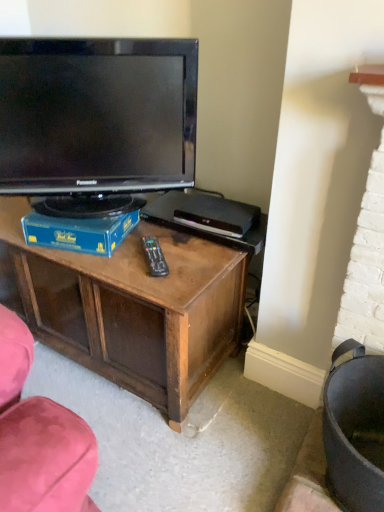
Describe the element at coordinates (97, 115) in the screenshot. I see `black glossy television at upper left` at that location.

This screenshot has height=512, width=384. I want to click on blue cardboard box at center, so pyautogui.click(x=79, y=232).

This screenshot has width=384, height=512. I want to click on black glossy television at upper left, so 97,115.

Considering the points (30, 225) and (145, 163), which point is behind, point (30, 225) or point (145, 163)?

The point (145, 163) is farther from the camera.

From the image's perspective, does blue cardboard box at center appear higher than black glossy television at upper left?

Incorrect, from the image's perspective, blue cardboard box at center is lower than black glossy television at upper left.

Could you tell me if blue cardboard box at center is turned towards black glossy television at upper left?

No, blue cardboard box at center is not oriented towards black glossy television at upper left.

Which is more to the left, blue cardboard box at center or black plastic remote at center?

From the viewer's perspective, blue cardboard box at center appears more on the left side.

Locate an element on the screen. remote in front of the blue cardboard box at center is located at coordinates (155, 257).

Is blue cardboard box at center positioned with its back to black plastic remote at center?

No, blue cardboard box at center is not facing the opposite direction of black plastic remote at center.

Can you confirm if blue cardboard box at center is taller than black plastic remote at center?

Yes, blue cardboard box at center is taller than black plastic remote at center.

Consider the image. Would you say black plastic remote at center is part of black glossy television at upper left's contents?

No, black glossy television at upper left does not contain black plastic remote at center.

You are a GUI agent. You are given a task and a screenshot of the screen. Output one action in this format:
    pyautogui.click(x=<x>, y=<y>)
    Task: Click on the television above the black plastic remote at center (from the image's perspective)
    
    Given the screenshot: What is the action you would take?
    pyautogui.click(x=97, y=115)

How many degrees apart are the facing directions of black glossy television at upper left and black plastic remote at center?

The angular difference between black glossy television at upper left and black plastic remote at center is 8.39 degrees.

Consider the image. Is black glossy television at upper left bigger or smaller than black plastic remote at center?

In the image, black glossy television at upper left appears to be larger than black plastic remote at center.

Looking at this image, is black plastic remote at center oriented away from blue cardboard box at center?

That's right, black plastic remote at center is facing away from blue cardboard box at center.

Does black plastic remote at center have a lesser height compared to blue cardboard box at center?

Yes.

Is there a large distance between black plastic remote at center and blue cardboard box at center?

They are positioned close to each other.

Which is more to the left, black plastic remote at center or blue cardboard box at center?

From the viewer's perspective, blue cardboard box at center appears more on the left side.

Considering the sizes of black glossy television at upper left and blue cardboard box at center in the image, is black glossy television at upper left wider or thinner than blue cardboard box at center?

black glossy television at upper left is thinner than blue cardboard box at center.

Can blue cardboard box at center be found inside black glossy television at upper left?

No.

Based on the photo, from a real-world perspective, which is physically above, black glossy television at upper left or blue cardboard box at center?

In real-world perspective, black glossy television at upper left is above.

Is black glossy television at upper left not close to blue cardboard box at center?

No.

Considering the relative positions of black plastic remote at center and black glossy television at upper left in the image provided, is black plastic remote at center to the left of black glossy television at upper left from the viewer's perspective?

No, black plastic remote at center is not to the left of black glossy television at upper left.

How far apart are black plastic remote at center and black glossy television at upper left?

A distance of 14.85 inches exists between black plastic remote at center and black glossy television at upper left.

From the image's perspective, is black plastic remote at center located above black glossy television at upper left?

Actually, black plastic remote at center appears below black glossy television at upper left in the image.

Locate an element on the screen. This screenshot has width=384, height=512. television located above the blue cardboard box at center (from a real-world perspective) is located at coordinates (97, 115).

Identify the location of remote below the blue cardboard box at center (from a real-world perspective). (155, 257).

Estimate the real-world distances between objects in this image. Which object is further from black plastic remote at center, blue cardboard box at center or black glossy television at upper left?

The object further to black plastic remote at center is black glossy television at upper left.

From the image, which object appears to be nearer to black plastic remote at center, black glossy television at upper left or blue cardboard box at center?

Among the two, blue cardboard box at center is located nearer to black plastic remote at center.

Which object lies further to the anchor point black glossy television at upper left, blue cardboard box at center or black plastic remote at center?

Based on the image, black plastic remote at center appears to be further to black glossy television at upper left.

Estimate the real-world distances between objects in this image. Which object is further from black glossy television at upper left, black plastic remote at center or blue cardboard box at center?

black plastic remote at center is further to black glossy television at upper left.

Considering their positions, is black glossy television at upper left positioned further to blue cardboard box at center than black plastic remote at center?

black glossy television at upper left lies further to blue cardboard box at center than the other object.

Estimate the real-world distances between objects in this image. Which object is further from blue cardboard box at center, black plastic remote at center or black glossy television at upper left?

black glossy television at upper left is positioned further to the anchor blue cardboard box at center.

Where is `book that lies between black glossy television at upper left and black plastic remote at center from top to bottom`? book that lies between black glossy television at upper left and black plastic remote at center from top to bottom is located at coordinates (79, 232).